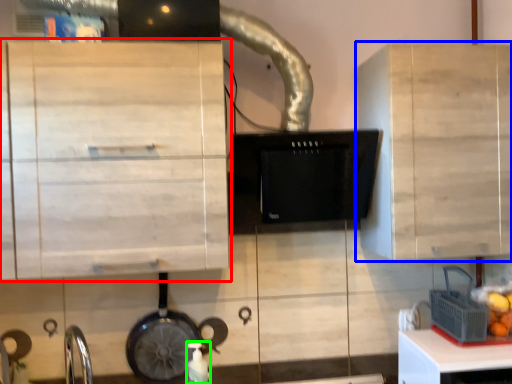
Question: Estimate the real-world distances between objects in this image. Which object is farther from cabinetry (highlighted by a red box), cabinetry (highlighted by a blue box) or bottle (highlighted by a green box)?

Choices:
 (A) cabinetry
 (B) bottle

Answer: (A)